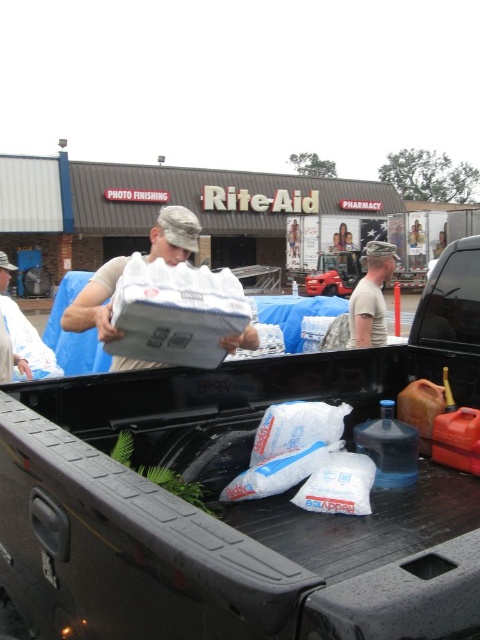
Question: Which of these objects is positioned closest to the black rubber truck bed at center?

Choices:
 (A) white plastic bag at center
 (B) white matte box at center

Answer: (B)

Question: Is black rubber truck bed at center above camouflage uniform at center?

Choices:
 (A) yes
 (B) no

Answer: (B)

Question: Among these objects, which one is nearest to the camera?

Choices:
 (A) white plastic bag at center
 (B) black rubber truck bed at center

Answer: (B)

Question: Is black rubber truck bed at center closer to the viewer compared to white plastic bag at center?

Choices:
 (A) yes
 (B) no

Answer: (A)

Question: Is white plastic bag at center positioned at the back of camouflage uniform at center?

Choices:
 (A) no
 (B) yes

Answer: (B)

Question: Among these points, which one is farthest from the camera?

Choices:
 (A) tap(3, 561)
 (B) tap(48, 355)
 (C) tap(168, 262)
 (D) tap(365, 269)

Answer: (D)